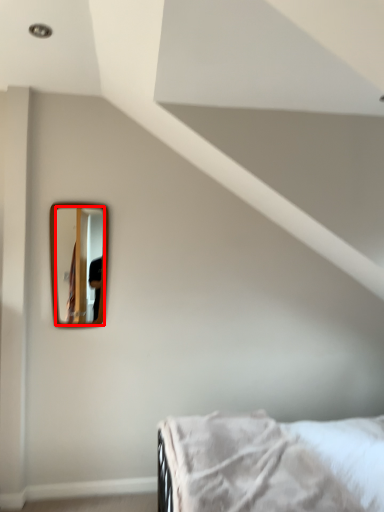
Question: Considering the relative positions of mirror (annotated by the red box) and bed in the image provided, where is mirror (annotated by the red box) located with respect to the staircase?

Choices:
 (A) left
 (B) right

Answer: (A)